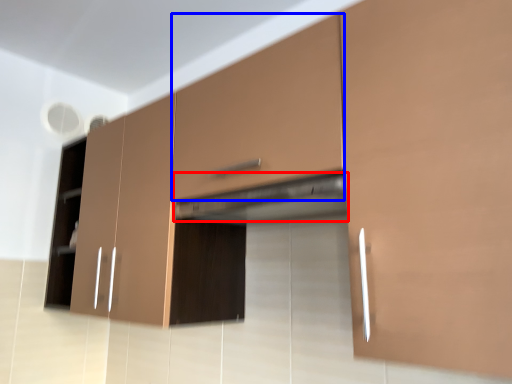
Question: Which point is closer to the camera, exhaust hood (highlighted by a red box) or drawer (highlighted by a blue box)?

Choices:
 (A) exhaust hood
 (B) drawer

Answer: (B)